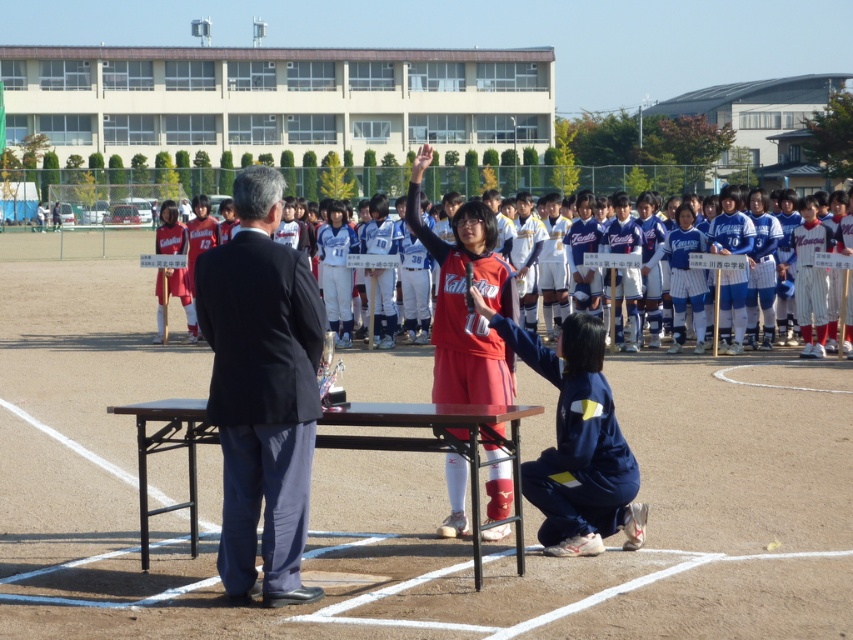
Consider the image. You are a photographer at the event and want to take a photo that includes both the black suit at center and the navy blue fabric uniform at lower center. Based on their positions, which one should you focus on first to ensure both are in frame?

The black suit at center is in front of the navy blue fabric uniform at lower center, so you should focus on the navy blue fabric uniform at lower center first to ensure both are in frame.

You are a photographer at the event and need to capture a photo of the matte red jersey at center and the wooden table at center. From the photographer perspective, which object is on the right side?

The matte red jersey at center is positioned on the right side of wooden table at center, so from the photographer perspective, the matte red jersey at center is on the right side.